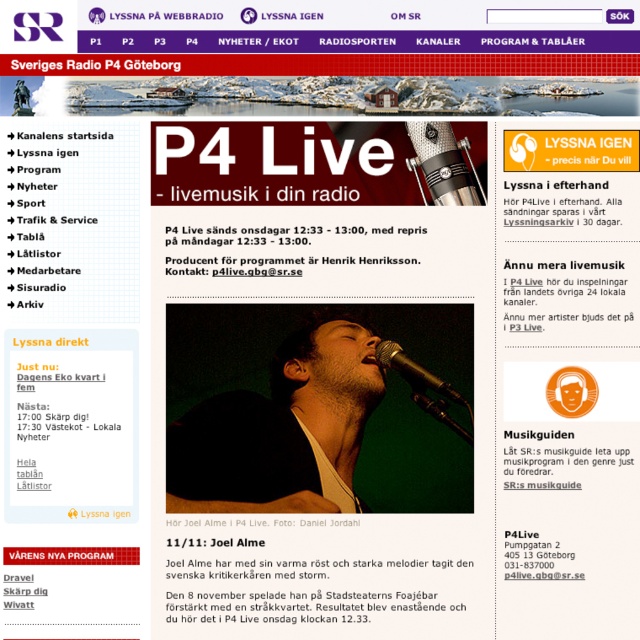
You are a listener visiting the Sveriges Radio P4 Gothenburg webpage. You notice a dark matte jacket at center and a metallic shiny microphone at center. Which object is located to the left of the other?

The dark matte jacket at center is positioned on the left side of the metallic shiny microphone at center.

You are a web designer reviewing the webpage layout. You notice the dark matte jacket at center and the silver metallic microphone at center. Which object appears closer to the viewer in the design?

The dark matte jacket at center is closer to the viewer than the silver metallic microphone at center.

You are looking at the webpage for Sveriges Radio P4 Goteborg. You see a silver metallic microphone at center and a metallic shiny microphone at center. Which microphone is positioned to the right?

The silver metallic microphone at center is positioned to the right of the metallic shiny microphone at center.